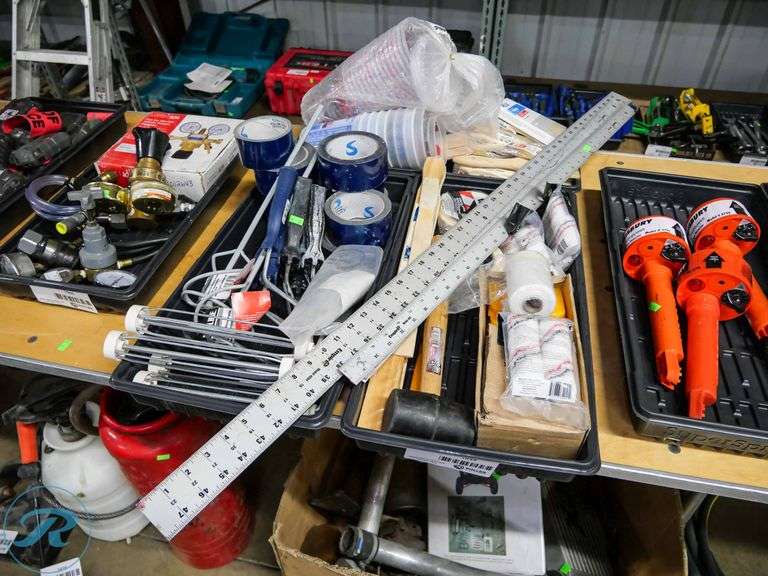
This screenshot has width=768, height=576. I want to click on cups, so (x=412, y=119), (x=402, y=46).